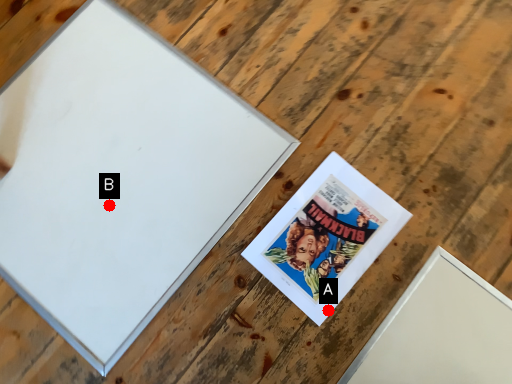
Question: Two points are circled on the image, labeled by A and B beside each circle. Which point is closer to the camera?

Choices:
 (A) A is closer
 (B) B is closer

Answer: (A)